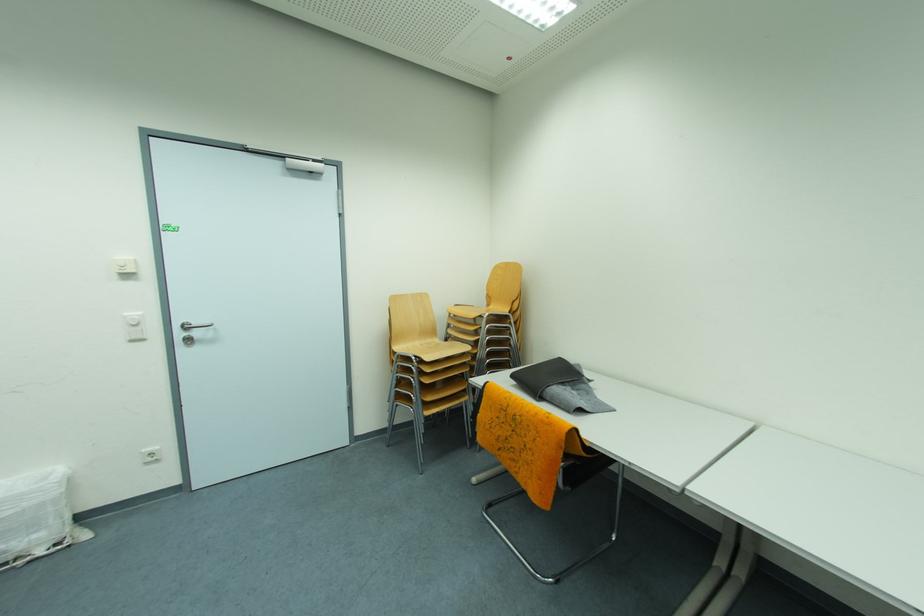
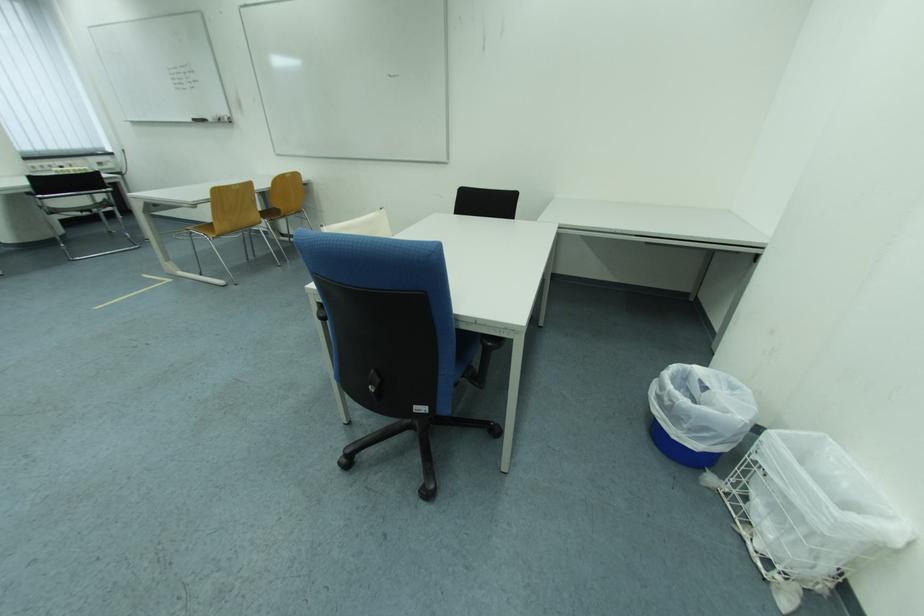
In the second image, find the point that corresponds to the point at 30,569 in the first image.

(745, 532)